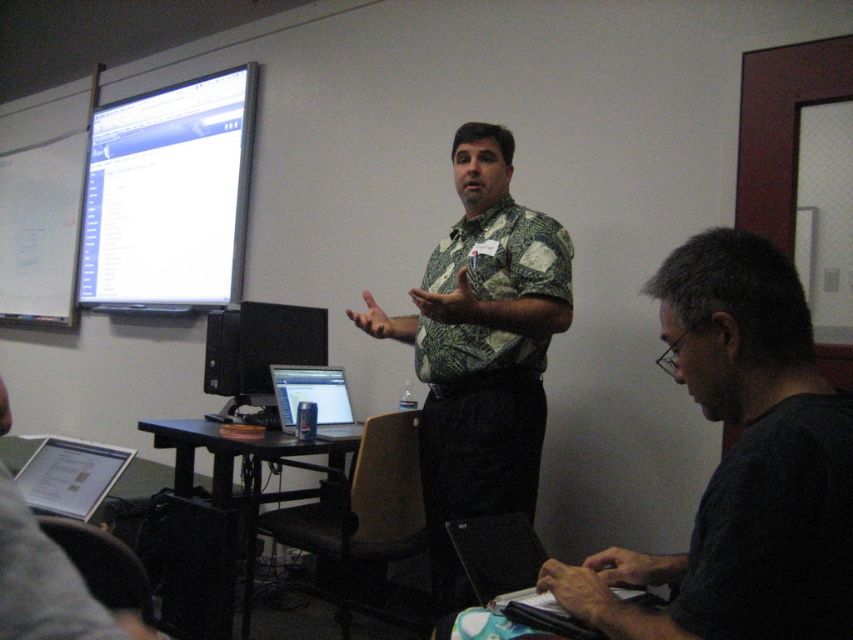
You are standing at the origin point of the room and want to walk to the dark gray shirt at lower right. According to the coordinate system where the bottom left corner is the origin, what direction should you move in to reach it?

The dark gray shirt at lower right is located at point (741, 464), which means it is positioned to the right and slightly above your current position. To reach it, move towards the upper right direction.

Based on the photo, you are standing in the classroom and want to move from point A to point B. Point A is located at coordinates point (x=262, y=348) and point B is at point (x=453, y=525). Which direction should you move to go from point A to point B?

To move from point A to point B, you should move diagonally towards the right and upwards since point B is located to the right and above point A in the coordinate system.

You are a participant in the meeting and need to adjust your view. Which object, the green patterned shirt at center or the matte black monitor at center, is positioned lower from your perspective?

The green patterned shirt at center is positioned below the matte black monitor at center, so the green patterned shirt at center is lower.